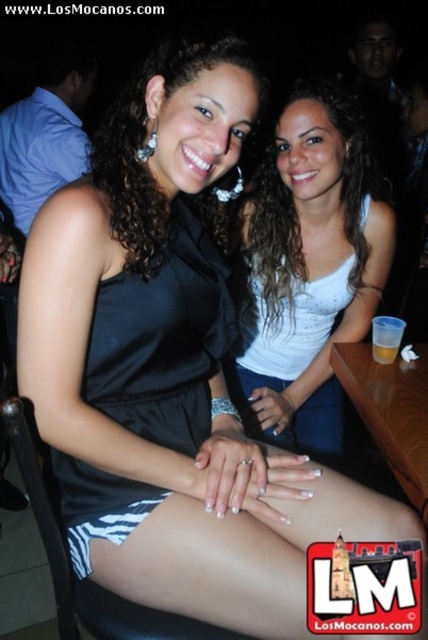
Who is more distant from viewer, (326, 340) or (385, 353)?

Positioned behind is point (326, 340).

Locate an element on the screen. The width and height of the screenshot is (428, 640). white glittery tank top at center is located at coordinates (309, 266).

The image size is (428, 640). Identify the location of white glittery tank top at center. (309, 266).

Based on the photo, who is positioned more to the left, black satin dress at center or translucent plastic cup at center?

Positioned to the left is black satin dress at center.

Between black satin dress at center and translucent plastic cup at center, which one appears on the right side from the viewer's perspective?

translucent plastic cup at center

Does point (95, 490) come in front of point (380, 353)?

That is True.

Locate an element on the screen. This screenshot has height=640, width=428. black satin dress at center is located at coordinates (163, 339).

Is white glittery tank top at center to the right of black satin dress at center from the viewer's perspective?

Correct, you'll find white glittery tank top at center to the right of black satin dress at center.

Which is more to the right, white glittery tank top at center or black satin dress at center?

white glittery tank top at center

Who is more forward, (246, 289) or (171, 208)?

Point (171, 208) is more forward.

Find the location of a particular element. This screenshot has width=428, height=640. white glittery tank top at center is located at coordinates coord(309,266).